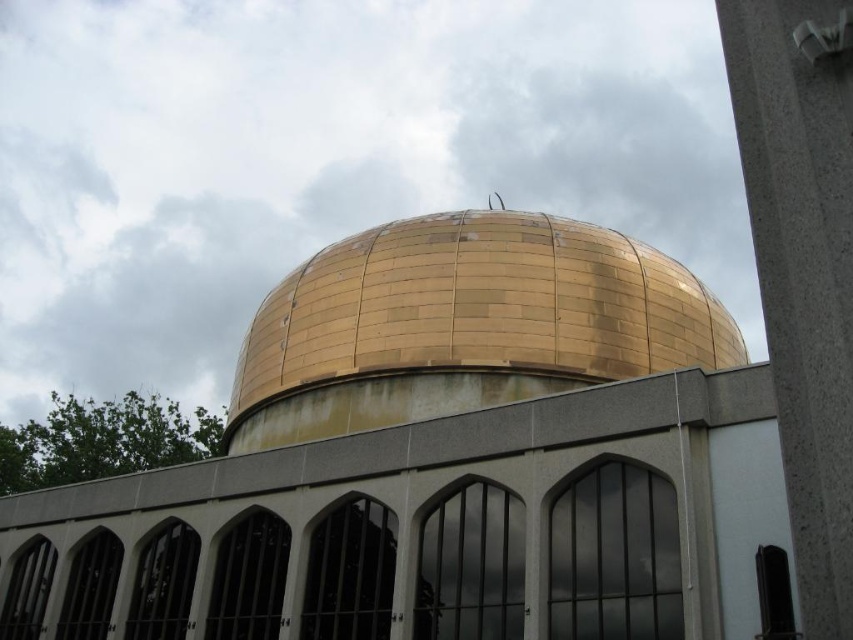
Between gold metallic dome at center and gray concrete pillar at right, which one has more height?

gold metallic dome at center

Who is positioned more to the right, gold metallic dome at center or gray concrete pillar at right?

gray concrete pillar at right

Does point (700, 291) come farther from viewer compared to point (815, 244)?

That is True.

The width and height of the screenshot is (853, 640). I want to click on gold metallic dome at center, so click(x=463, y=324).